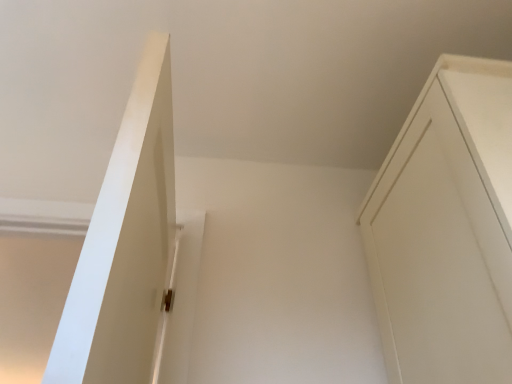
Image resolution: width=512 pixels, height=384 pixels. What do you see at coordinates (125, 243) in the screenshot?
I see `white smooth door at left` at bounding box center [125, 243].

The width and height of the screenshot is (512, 384). Find the location of `white smooth door at left`. white smooth door at left is located at coordinates (125, 243).

In order to face white smooth door at left, should I rotate leftwards or rightwards?

You should look left and rotate roughly 14.942 degrees.

Locate an element on the screen. The height and width of the screenshot is (384, 512). white smooth door at left is located at coordinates (125, 243).